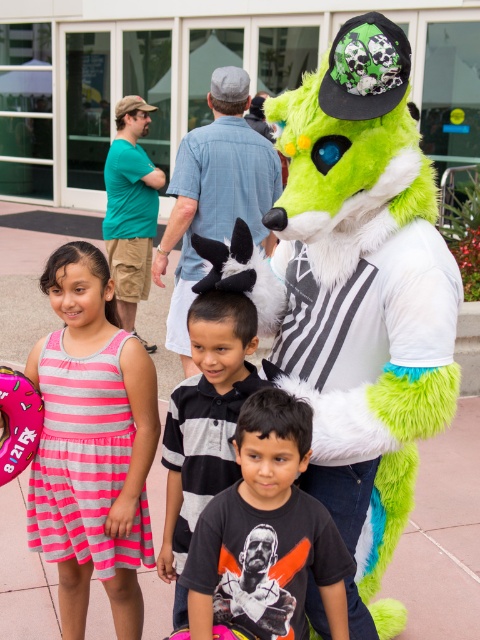
Question: Which of the following is the farthest from the observer?

Choices:
 (A) white fur hat at center
 (B) black striped shirt at center
 (C) black matte shirt at center

Answer: (A)

Question: Does black striped shirt at center appear over white fur hat at center?

Choices:
 (A) no
 (B) yes

Answer: (A)

Question: Among these objects, which one is farthest from the camera?

Choices:
 (A) black striped shirt at center
 (B) fluffy green costume at center
 (C) pink striped dress at left
 (D) white fur hat at center

Answer: (D)

Question: Does fluffy green costume at center have a smaller size compared to black striped shirt at center?

Choices:
 (A) no
 (B) yes

Answer: (A)

Question: Is black matte shirt at center smaller than white fur hat at center?

Choices:
 (A) yes
 (B) no

Answer: (A)

Question: Which of the following is the farthest from the observer?

Choices:
 (A) (273, 605)
 (B) (238, 179)
 (C) (241, 392)
 (D) (369, 257)

Answer: (B)